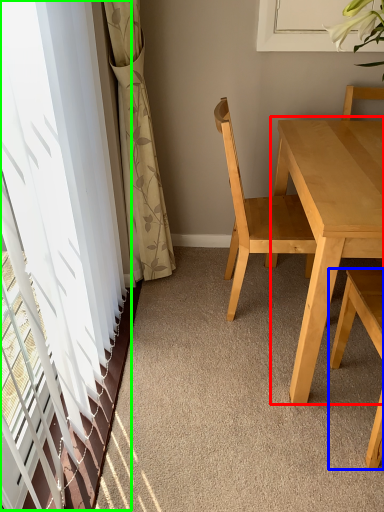
Question: Estimate the real-world distances between objects in this image. Which object is closer to kitchen & dining room table (highlighted by a red box), chair (highlighted by a blue box) or window (highlighted by a green box)?

Choices:
 (A) chair
 (B) window

Answer: (A)